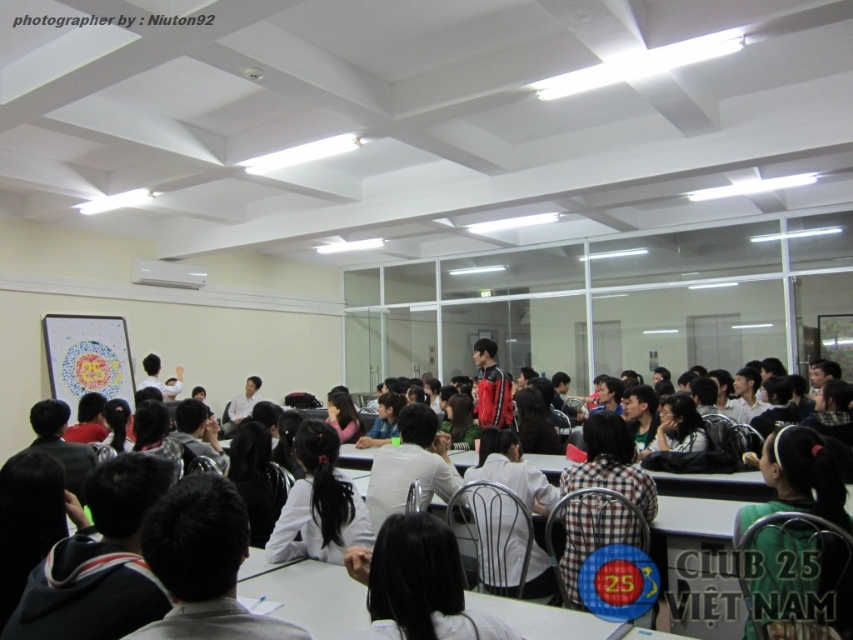
You are a student sitting at a table in the classroom. You notice two points marked on the floor. The first point is at coordinate point (526, 632) and the second is at point (508, 381). If you are facing the front of the classroom, which point is closer to the front wall?

Point (526, 632) is in front of point (508, 381), so it is closer to the front wall.

You are a student in the classroom and want to write something on the matte black board at center. To reach it, you need to pass by the red leather jacket at center. Since both are at the center, which one is closer to you?

The matte black board at center is below the red leather jacket at center, so the red leather jacket at center is closer to you. You would need to move past the red leather jacket at center to reach the matte black board at center.

You are a student in the classroom and want to write on the board. Where should you go to reach the point at coordinates [306,593]?

The point at coordinates [306,593] is located on the matte black board at center, so you should go to the matte black board at center to reach it.